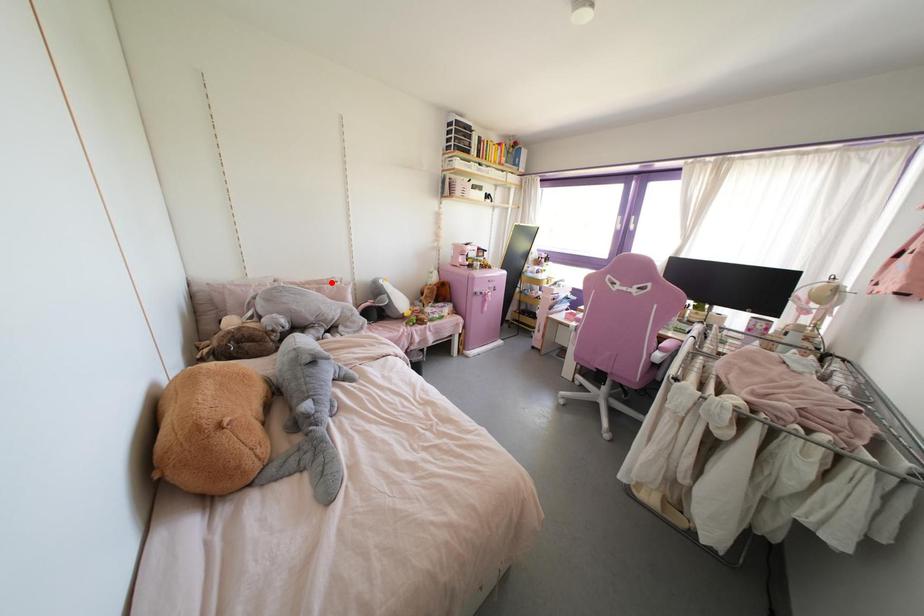
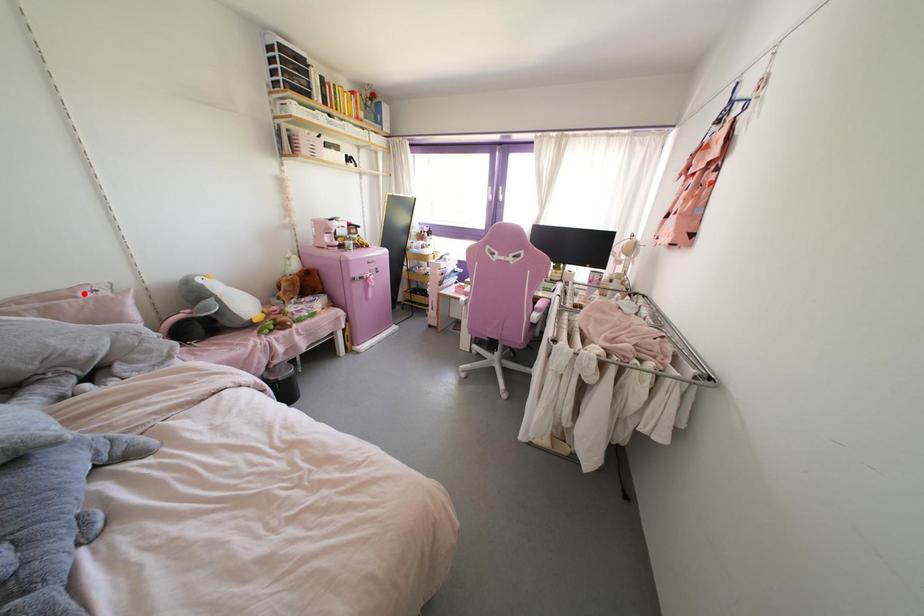
In the scene shown: I am providing you with two images of the same scene from different viewpoints. A red point is marked on the first image and another point is marked on the second image. Is the marked point in image1 the same physical position as the marked point in image2?

Yes